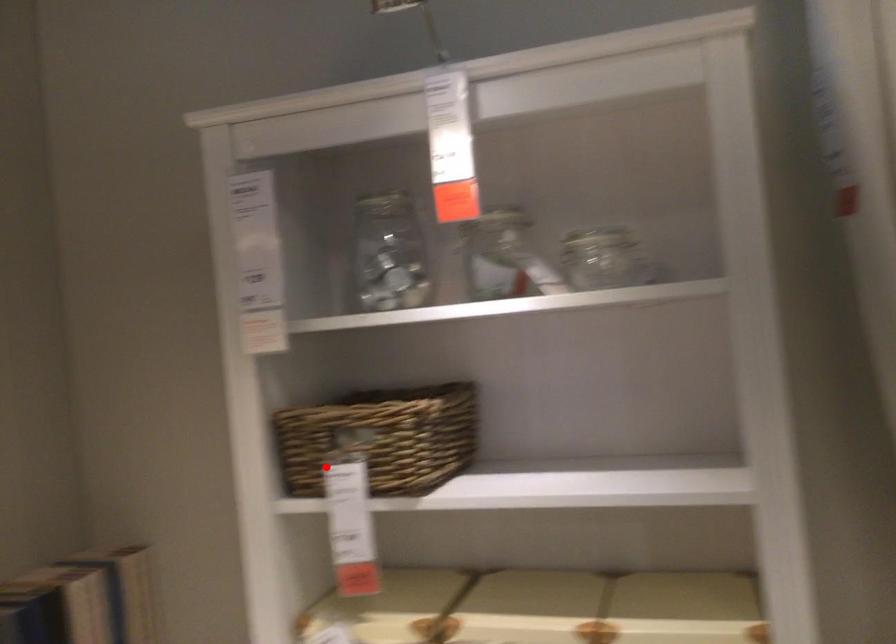
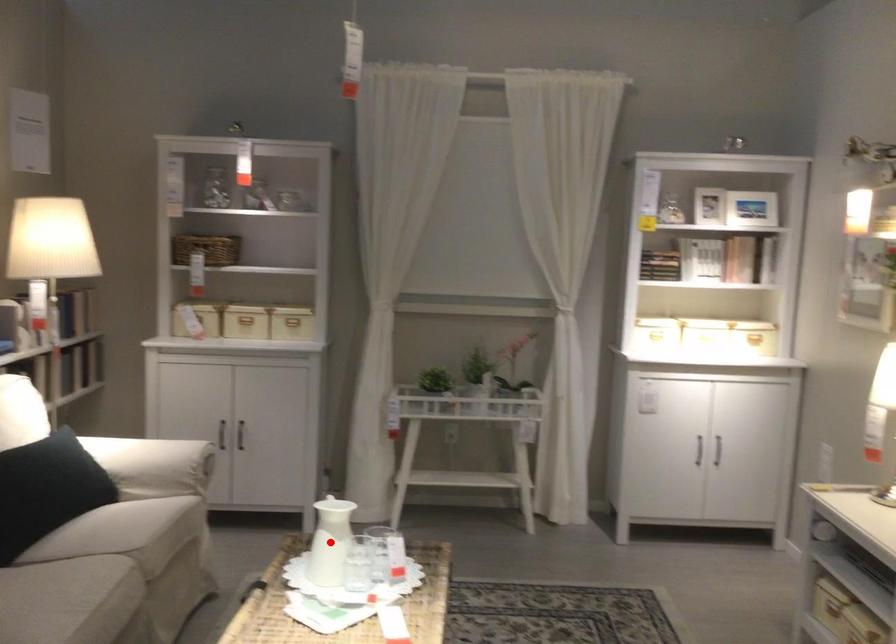
I am providing you with two images of the same scene from different viewpoints. A red point is marked on the first image and another point is marked on the second image. Are the points marked in image1 and image2 representing the same 3D position?

No